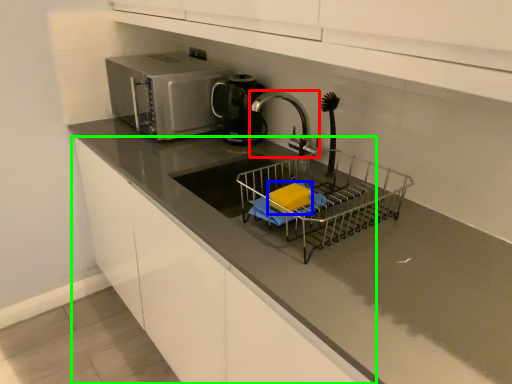
Question: Which object is the farthest from tap (highlighted by a red box)? Choose among these: food (highlighted by a blue box) or cabinetry (highlighted by a green box).

Choices:
 (A) food
 (B) cabinetry

Answer: (B)